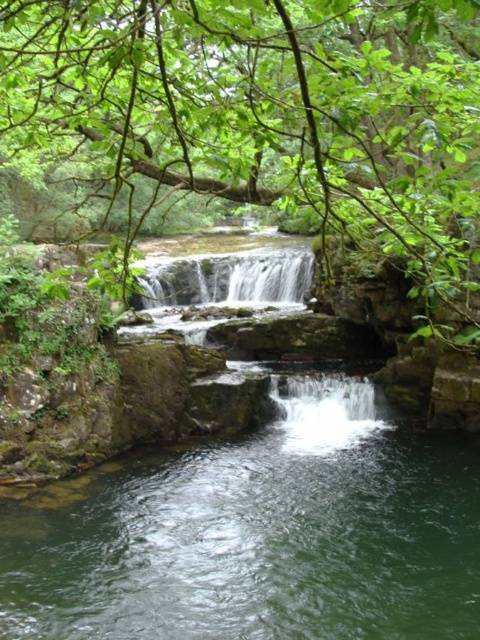
Question: Observing the image, what is the correct spatial positioning of clear water at center in reference to white smooth waterfall at center?

Choices:
 (A) above
 (B) below

Answer: (B)

Question: Which of the following is the farthest from the observer?

Choices:
 (A) (113, 195)
 (B) (286, 250)

Answer: (B)

Question: Which point is closer to the camera?

Choices:
 (A) (345, 177)
 (B) (204, 253)
 (C) (214, 637)

Answer: (C)

Question: Among these points, which one is nearest to the camera?

Choices:
 (A) (173, 556)
 (B) (176, 282)
 (C) (24, 104)

Answer: (C)

Question: Can you confirm if clear water at center is bigger than green leafy tree at center?

Choices:
 (A) yes
 (B) no

Answer: (B)

Question: Is green leafy tree at center above white smooth waterfall at center?

Choices:
 (A) no
 (B) yes

Answer: (B)